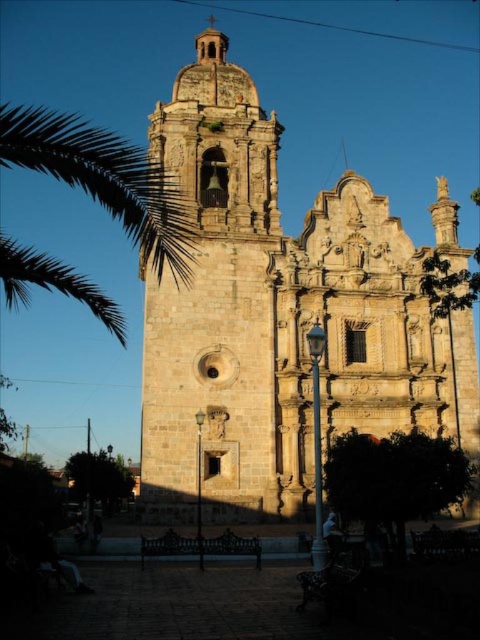
You are standing in a garden adjacent to the church and want to take a photo of the stone tower at center and the green leafy palm at left. Which object should you position closer to the camera to ensure both are in focus?

The stone tower at center is positioned under green leafy palm at left, so to ensure both are in focus, position the green leafy palm at left closer to the camera since it is farther away than the stone tower at center.

You are standing at the entrance of the historic stone church at center. If you face the bell tower on the left, which direction should you turn to look towards the central circular window?

Since the stone church at center is located at point coordinates, the bell tower is on the left side of the building. To look towards the central circular window, which is part of the church facade, you would turn to your right. This is because the circular window is centrally positioned, so after facing the bell tower on the left, turning right would align you with the center of the church where the window is located.